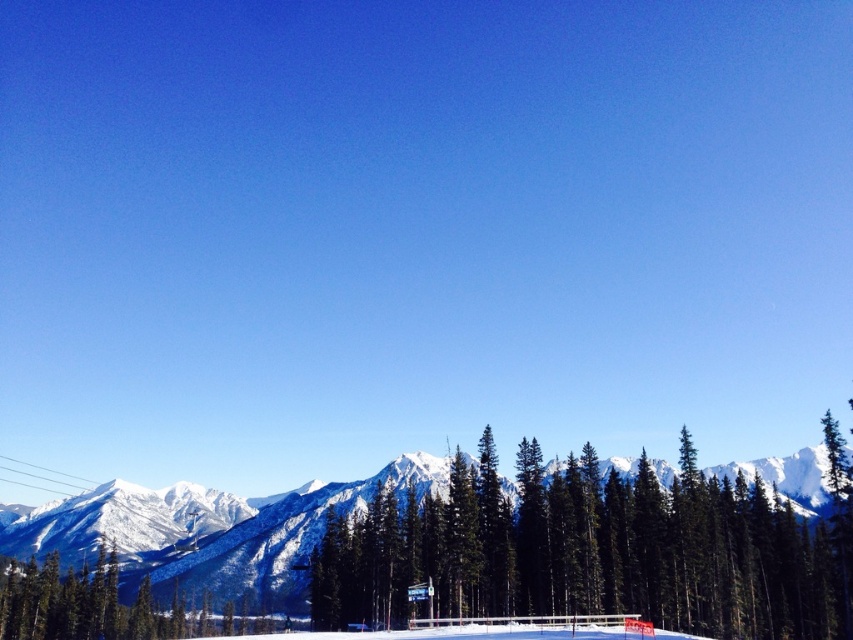
Question: Does green matte tree at center have a greater width compared to green matte tree at lower left?

Choices:
 (A) no
 (B) yes

Answer: (B)

Question: Is green matte tree at center below green matte tree at lower left?

Choices:
 (A) no
 (B) yes

Answer: (A)

Question: Does green matte tree at center have a lesser width compared to green matte tree at lower left?

Choices:
 (A) yes
 (B) no

Answer: (B)